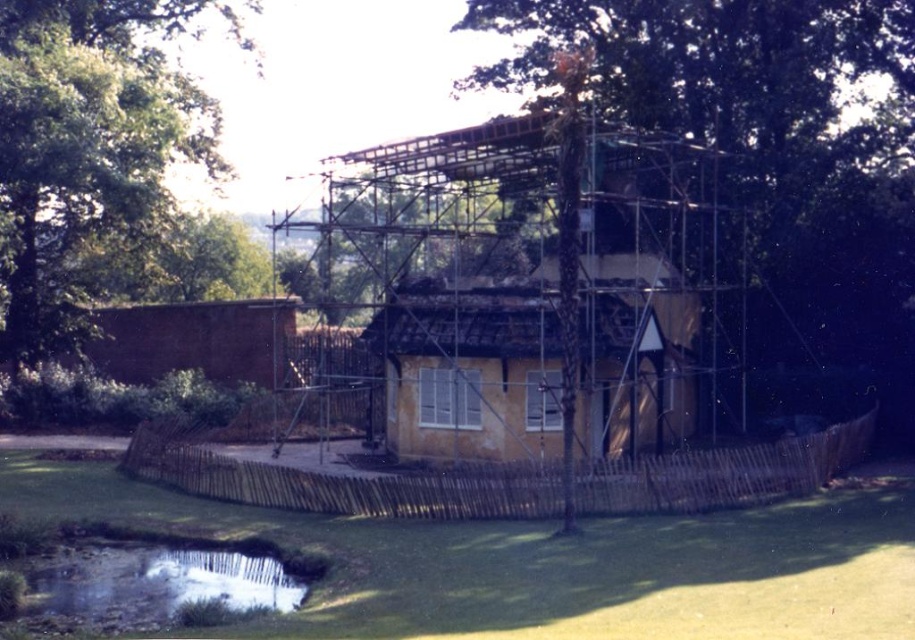
You are standing at the entrance of the construction site and notice the green leafy tree at upper left and the reflective gravel creek at lower left. Which object is positioned higher relative to the other?

The green leafy tree at upper left is located above the reflective gravel creek at lower left, so it is positioned higher.

You are a contractor assessing a property. You see the yellow wood house at center and the reflective gravel creek at lower left. Which object is located above the other?

The yellow wood house at center is positioned over reflective gravel creek at lower left, so the house is above the creek.